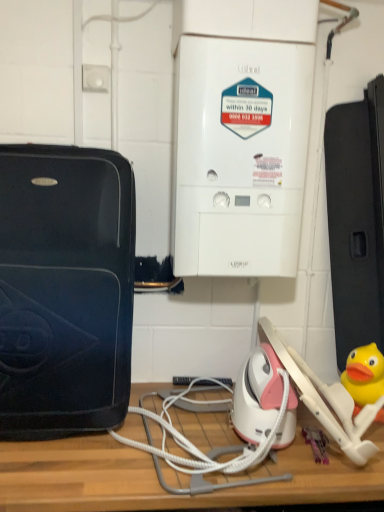
I want to click on blank space situated above wooden table at center (from a real-world perspective), so [x=177, y=440].